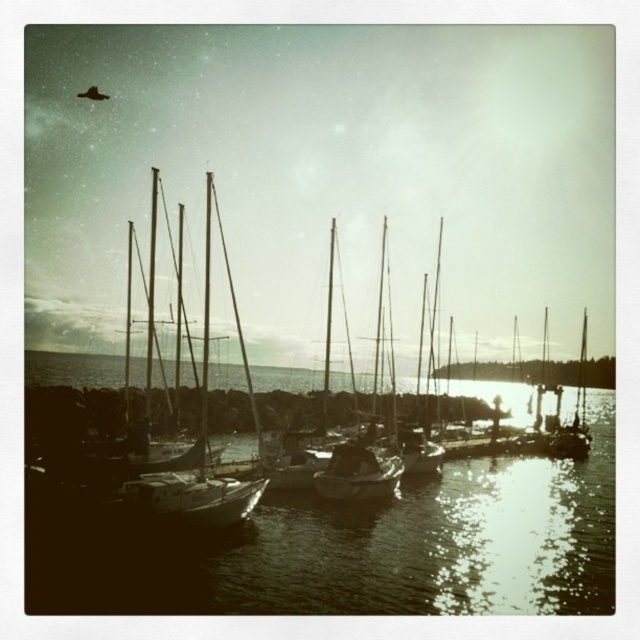
Question: Can you confirm if sepia reflective water at center is wider than matte white boat at center?

Choices:
 (A) no
 (B) yes

Answer: (B)

Question: Can you confirm if sepia reflective water at center is smaller than matte white boat at center?

Choices:
 (A) no
 (B) yes

Answer: (A)

Question: Which object appears closest to the camera in this image?

Choices:
 (A) matte white boat at center
 (B) sepia reflective water at center

Answer: (B)

Question: Is sepia reflective water at center to the left of matte white boat at center from the viewer's perspective?

Choices:
 (A) yes
 (B) no

Answer: (A)